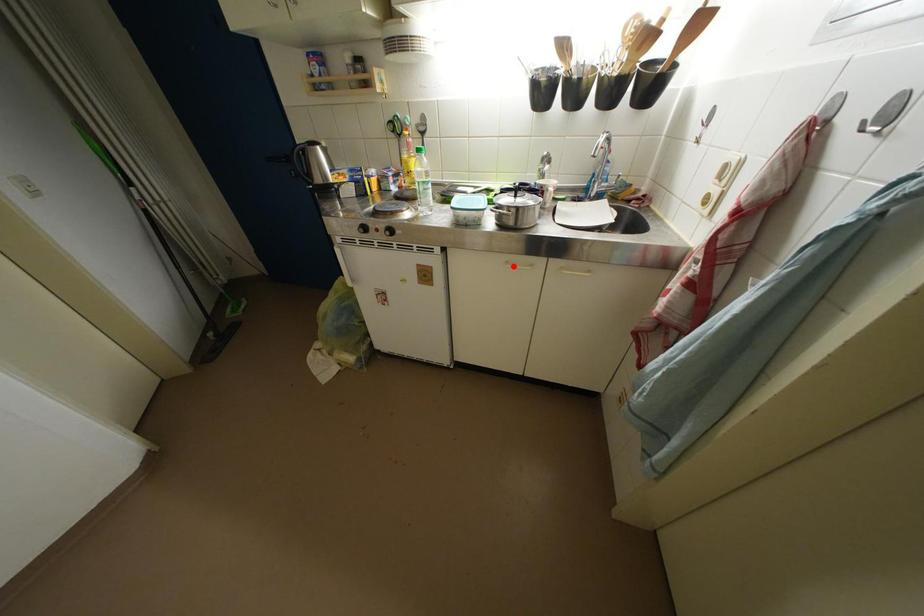
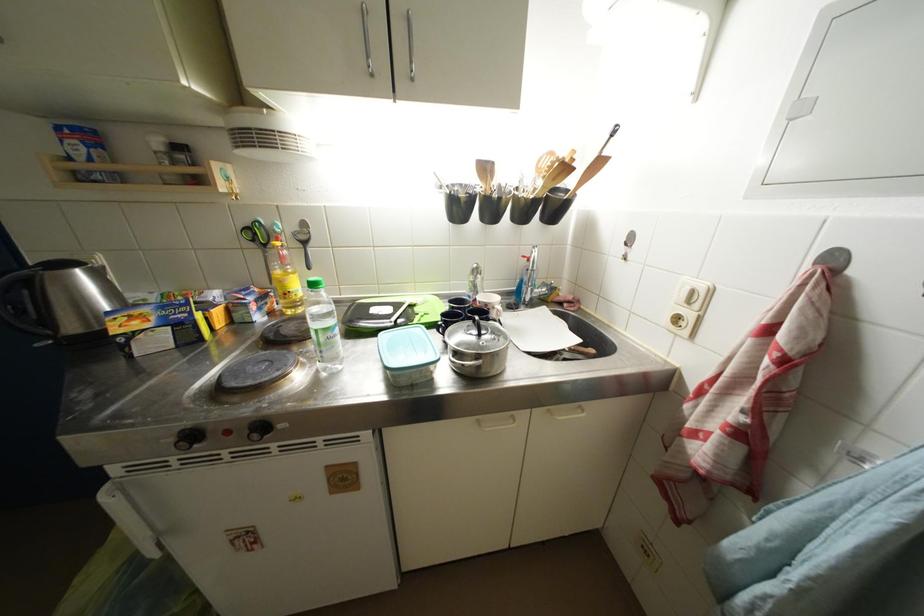
Question: I am providing you with two images of the same scene from different viewpoints. Given a red point in image1, look at the same physical point in image2. Is it:

Choices:
 (A) Closer to the viewpoint
 (B) Farther from the viewpoint

Answer: (B)